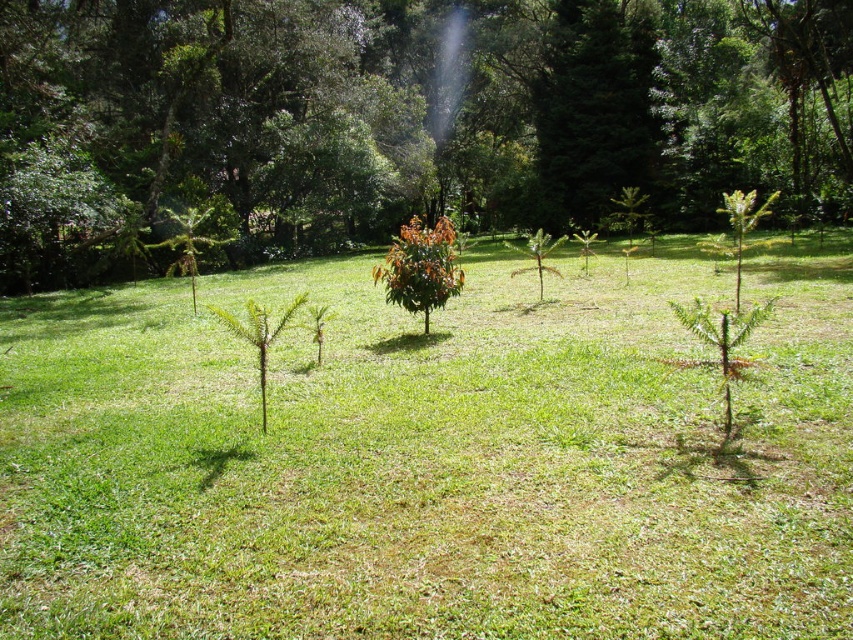
You are a gardener who wants to plant a new flower bed between the green grassy at center and the green leafy tree at center. Since you need to know which area is narrower to decide where to place the flowers, can you tell me which one is narrower?

The green grassy at center has a lesser width compared to green leafy tree at center, so the green grassy at center is narrower. Therefore, the flower bed should be placed there.

Looking at this image, you are standing in a garden and want to place a 3.5 meter long ladder between you and the green grassy at center. Can you fit the ladder horizontally without bending it?

The distance between you and the green grassy at center is 3.07 meters, which is shorter than the ladder length of 3.5 meters. Therefore, the ladder cannot be placed horizontally without bending it.